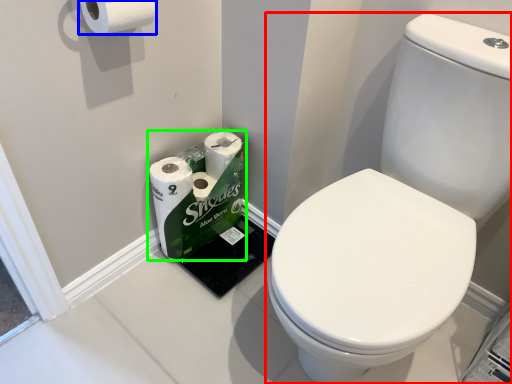
Question: Which object is the farthest from toilet (highlighted by a red box)? Choose among these: toilet paper (highlighted by a blue box) or toilet paper (highlighted by a green box).

Choices:
 (A) toilet paper
 (B) toilet paper

Answer: (A)